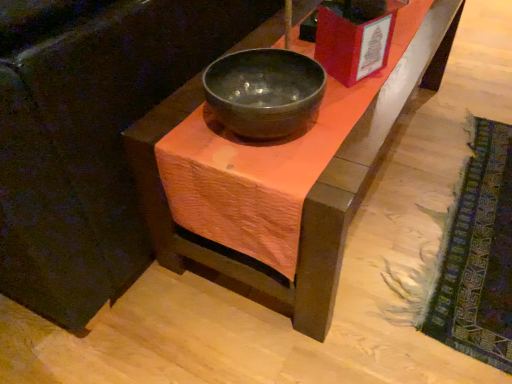
Question: Is textured woolen mat at lower right not inside matte black bowl at center?

Choices:
 (A) no
 (B) yes

Answer: (B)

Question: Can you confirm if textured woolen mat at lower right is smaller than matte black bowl at center?

Choices:
 (A) yes
 (B) no

Answer: (A)

Question: From a real-world perspective, is textured woolen mat at lower right positioned over matte black bowl at center based on gravity?

Choices:
 (A) yes
 (B) no

Answer: (B)

Question: Is textured woolen mat at lower right further to the viewer compared to matte black bowl at center?

Choices:
 (A) no
 (B) yes

Answer: (B)

Question: From the image's perspective, is textured woolen mat at lower right beneath matte black bowl at center?

Choices:
 (A) yes
 (B) no

Answer: (A)

Question: From a real-world perspective, is matte black bowl at center above or below matte black bowl at center?

Choices:
 (A) below
 (B) above

Answer: (A)

Question: From their relative heights in the image, would you say matte black bowl at center is taller or shorter than matte black bowl at center?

Choices:
 (A) tall
 (B) short

Answer: (A)

Question: Is matte black bowl at center situated inside matte black bowl at center or outside?

Choices:
 (A) inside
 (B) outside

Answer: (B)

Question: Considering the positions of matte black bowl at center and matte black bowl at center in the image, is matte black bowl at center wider or thinner than matte black bowl at center?

Choices:
 (A) thin
 (B) wide

Answer: (B)

Question: From a real-world perspective, is matte black bowl at center positioned above or below matte black bowl at center?

Choices:
 (A) below
 (B) above

Answer: (B)

Question: From their relative heights in the image, would you say matte black bowl at center is taller or shorter than matte black bowl at center?

Choices:
 (A) short
 (B) tall

Answer: (A)

Question: Is matte black bowl at center bigger or smaller than matte black bowl at center?

Choices:
 (A) small
 (B) big

Answer: (A)

Question: From the image's perspective, is matte black bowl at center located above or below matte black bowl at center?

Choices:
 (A) below
 (B) above

Answer: (A)

Question: Considering the positions of matte black bowl at center and textured woolen mat at lower right in the image, is matte black bowl at center bigger or smaller than textured woolen mat at lower right?

Choices:
 (A) big
 (B) small

Answer: (B)

Question: Is matte black bowl at center taller or shorter than textured woolen mat at lower right?

Choices:
 (A) tall
 (B) short

Answer: (A)